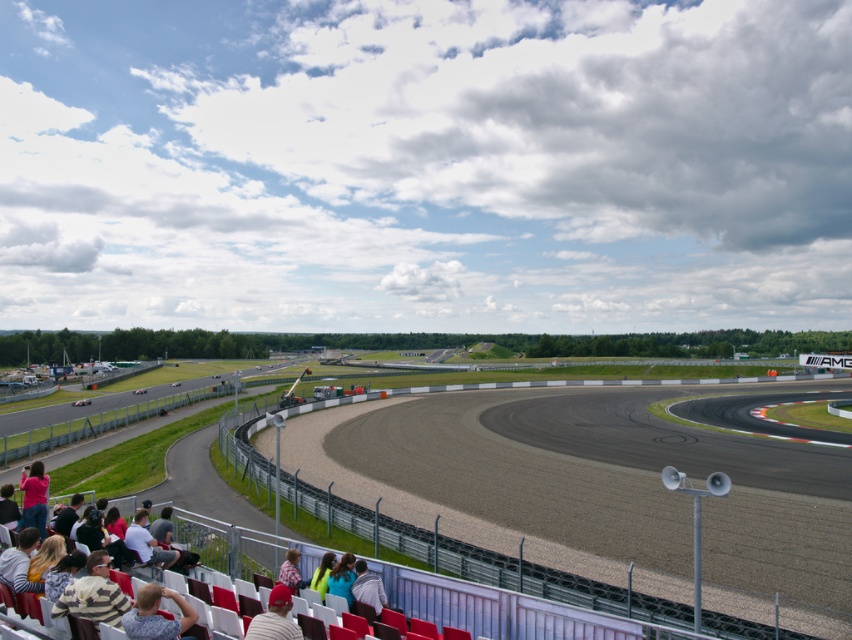
Question: Which point is farther to the camera?

Choices:
 (A) (724, 560)
 (B) (41, 531)
 (C) (360, 600)

Answer: (A)

Question: Can you confirm if light brown fabric jacket at lower center is bigger than green fabric jacket at lower center?

Choices:
 (A) no
 (B) yes

Answer: (A)

Question: Which point is farther to the camera?

Choices:
 (A) (326, 580)
 (B) (366, 588)

Answer: (A)

Question: Is matte red cap at lower center positioned in front of teal fabric jacket at lower center?

Choices:
 (A) yes
 (B) no

Answer: (A)

Question: Is camouflage fabric shirt at lower left smaller than matte red cap at lower center?

Choices:
 (A) no
 (B) yes

Answer: (A)

Question: Which point appears closest to the camera in this image?

Choices:
 (A) (315, 570)
 (B) (281, 580)
 (C) (275, 611)
 (D) (551, 480)

Answer: (C)